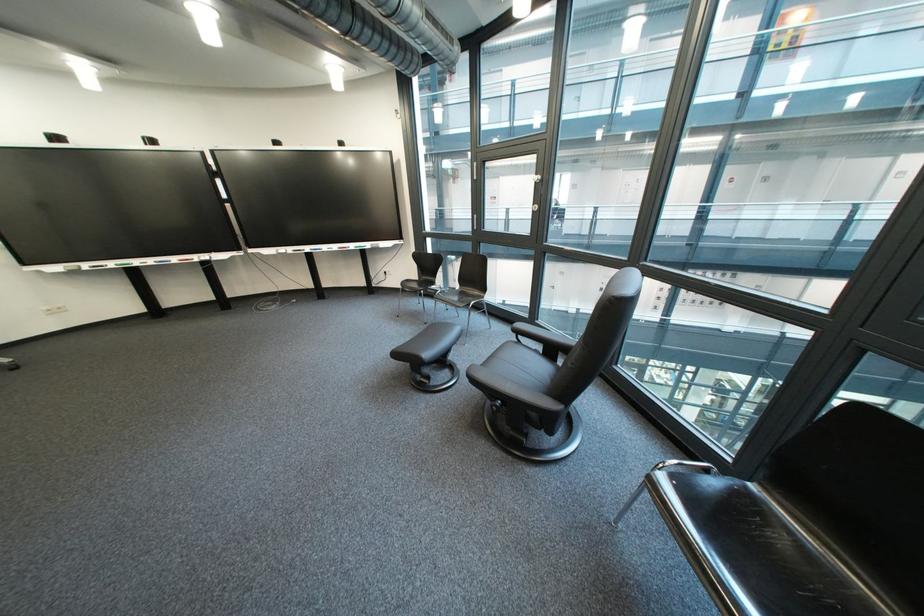
The height and width of the screenshot is (616, 924). What do you see at coordinates (757, 552) in the screenshot?
I see `the black bench sitting surface` at bounding box center [757, 552].